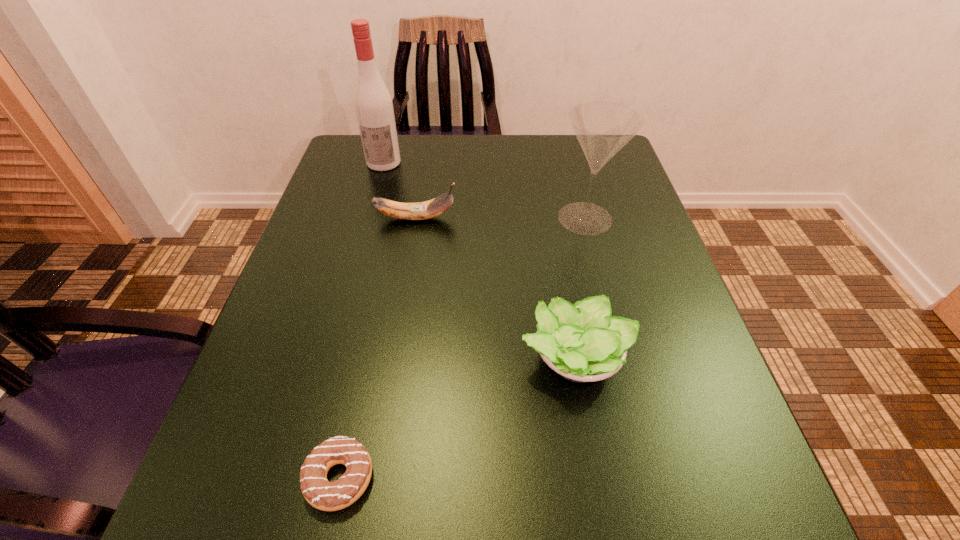
At what (x,y) coordinates should I click in order to perform the action: click on vacant area that lies between the nearest object and the fourth farthest object. Please return your answer as a coordinate pair (x, y). Looking at the image, I should click on (457, 418).

Locate an element on the screen. free space between the second shortest object and the banana is located at coordinates (495, 288).

At what (x,y) coordinates should I click in order to perform the action: click on unoccupied position between the tallest object and the flute glass. Please return your answer as a coordinate pair (x, y). Looking at the image, I should click on (485, 190).

Where is `free space between the fourth tallest object and the doughnut`? free space between the fourth tallest object and the doughnut is located at coordinates (457, 418).

Image resolution: width=960 pixels, height=540 pixels. Identify the location of free area in between the tallest object and the fourth shortest object. (485, 190).

Where is `free space between the alcohol and the nearest object`? Image resolution: width=960 pixels, height=540 pixels. free space between the alcohol and the nearest object is located at coordinates (362, 320).

The image size is (960, 540). In order to click on blank region between the farthest object and the flute glass in this screenshot , I will do `click(485, 190)`.

Locate an element on the screen. The width and height of the screenshot is (960, 540). object that is the closest one to the nearest object is located at coordinates (582, 342).

Locate which object ranks fourth in proximity to the banana. Please provide its 2D coordinates. Your answer should be formatted as a tuple, i.e. [(x, y)], where the tuple contains the x and y coordinates of a point satisfying the conditions above.

[(320, 493)]

Where is `free space that satisfies the following two spatial constraints: 1. on the label of the alcohol; 2. on the left side of the fourth tallest object`? free space that satisfies the following two spatial constraints: 1. on the label of the alcohol; 2. on the left side of the fourth tallest object is located at coordinates (329, 358).